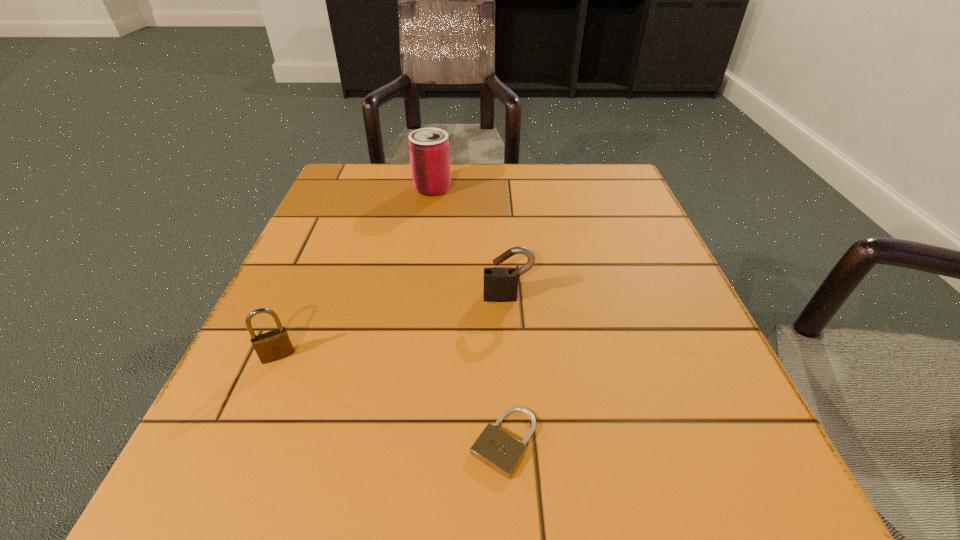
What are the coordinates of `free space between the leftmost padlock and the second farthest object` in the screenshot? It's located at (393, 327).

The width and height of the screenshot is (960, 540). I want to click on unoccupied position between the second nearest padlock and the third nearest object, so click(393, 327).

Image resolution: width=960 pixels, height=540 pixels. In order to click on the third closest object to the leftmost padlock in this screenshot , I will do `click(429, 148)`.

Identify the location of the closest object relative to the second object from left to right. (502, 282).

Where is `the second closest padlock to the farthest padlock`? Image resolution: width=960 pixels, height=540 pixels. the second closest padlock to the farthest padlock is located at coordinates (274, 345).

The width and height of the screenshot is (960, 540). What are the coordinates of `the second closest padlock to the nearest padlock` in the screenshot? It's located at [274, 345].

At what (x,y) coordinates should I click in order to perform the action: click on free space that satisfies the following two spatial constraints: 1. on the front side of the shortest padlock; 2. on the left side of the can. Please return your answer as a coordinate pair (x, y). Image resolution: width=960 pixels, height=540 pixels. Looking at the image, I should click on (x=392, y=442).